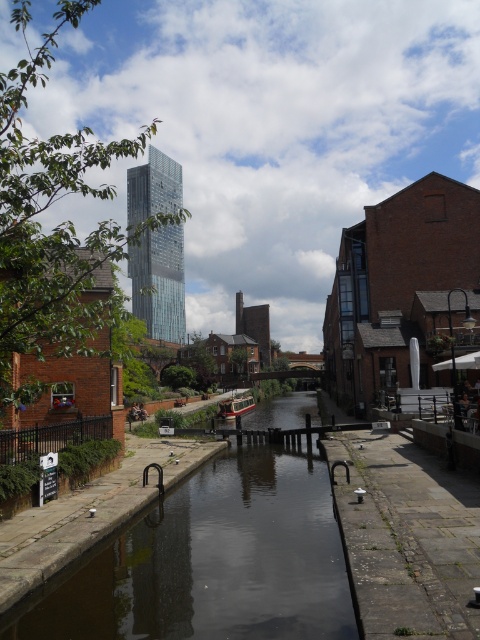
Can you confirm if dark reflective water at center is shorter than wooden boat at center?

In fact, dark reflective water at center may be taller than wooden boat at center.

Between dark reflective water at center and wooden boat at center, which one is positioned higher?

dark reflective water at center is higher up.

Does point (232, 477) come farther from viewer compared to point (225, 408)?

No, it is not.

Identify the location of dark reflective water at center. The image size is (480, 640). (212, 563).